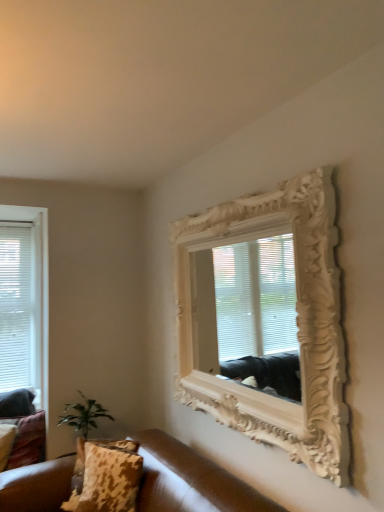
Question: Are green leafy plant at lower left and leopard print fabric pillow at lower left, marked as the 3th pillow in a front-to-back arrangement, far apart?

Choices:
 (A) no
 (B) yes

Answer: (A)

Question: Is leopard print fabric pillow at lower left, marked as the 3th pillow in a front-to-back arrangement, inside green leafy plant at lower left?

Choices:
 (A) yes
 (B) no

Answer: (B)

Question: Is green leafy plant at lower left positioned before leopard print fabric pillow at lower left, marked as the 3th pillow in a front-to-back arrangement?

Choices:
 (A) yes
 (B) no

Answer: (A)

Question: Considering the relative sizes of green leafy plant at lower left and leopard print fabric pillow at lower left, the first pillow viewed from the back, in the image provided, is green leafy plant at lower left taller than leopard print fabric pillow at lower left, the first pillow viewed from the back,?

Choices:
 (A) no
 (B) yes

Answer: (B)

Question: Is green leafy plant at lower left at the left side of leopard print fabric pillow at lower left, which ranks as the second pillow in left-to-right order?

Choices:
 (A) no
 (B) yes

Answer: (A)

Question: Considering their positions, is white carved wood mirror at upper right located in front of or behind brown leather couch at lower left?

Choices:
 (A) behind
 (B) front

Answer: (A)

Question: In terms of height, does white carved wood mirror at upper right look taller or shorter compared to brown leather couch at lower left?

Choices:
 (A) tall
 (B) short

Answer: (A)

Question: Is white carved wood mirror at upper right inside or outside of brown leather couch at lower left?

Choices:
 (A) inside
 (B) outside

Answer: (B)

Question: Based on their sizes in the image, would you say white carved wood mirror at upper right is bigger or smaller than brown leather couch at lower left?

Choices:
 (A) small
 (B) big

Answer: (A)

Question: Relative to leopard print fabric pillow at lower left, which appears as the 2th pillow when viewed from the right, is leopard print fabric pillow at lower left, the 3th pillow when ordered from back to front, in front or behind?

Choices:
 (A) behind
 (B) front

Answer: (B)

Question: Looking at their shapes, would you say leopard print fabric pillow at lower left, positioned as the 1th pillow in right-to-left order, is wider or thinner than leopard print fabric pillow at lower left, which ranks as the second pillow in left-to-right order?

Choices:
 (A) wide
 (B) thin

Answer: (B)

Question: Based on their sizes in the image, would you say leopard print fabric pillow at lower left, the 3th pillow when ordered from back to front, is bigger or smaller than leopard print fabric pillow at lower left, which ranks as the second pillow in left-to-right order?

Choices:
 (A) big
 (B) small

Answer: (B)

Question: Considering the relative positions of leopard print fabric pillow at lower left, the third pillow from the left, and leopard print fabric pillow at lower left, which ranks as the second pillow in left-to-right order, in the image provided, is leopard print fabric pillow at lower left, the third pillow from the left, to the left or to the right of leopard print fabric pillow at lower left, which ranks as the second pillow in left-to-right order,?

Choices:
 (A) right
 (B) left

Answer: (A)

Question: From the image's perspective, is green leafy plant at lower left above or below leopard print fabric pillow at lower left, marked as the 3th pillow in a front-to-back arrangement?

Choices:
 (A) below
 (B) above

Answer: (B)

Question: Visually, is green leafy plant at lower left positioned to the left or to the right of leopard print fabric pillow at lower left, which appears as the 2th pillow when viewed from the right?

Choices:
 (A) left
 (B) right

Answer: (B)